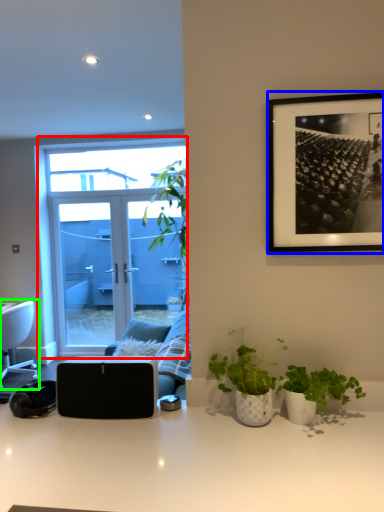
Question: Based on their relative distances, which object is farther from window (highlighted by a red box)? Choose from picture frame (highlighted by a blue box) and chair (highlighted by a green box).

Choices:
 (A) picture frame
 (B) chair

Answer: (A)